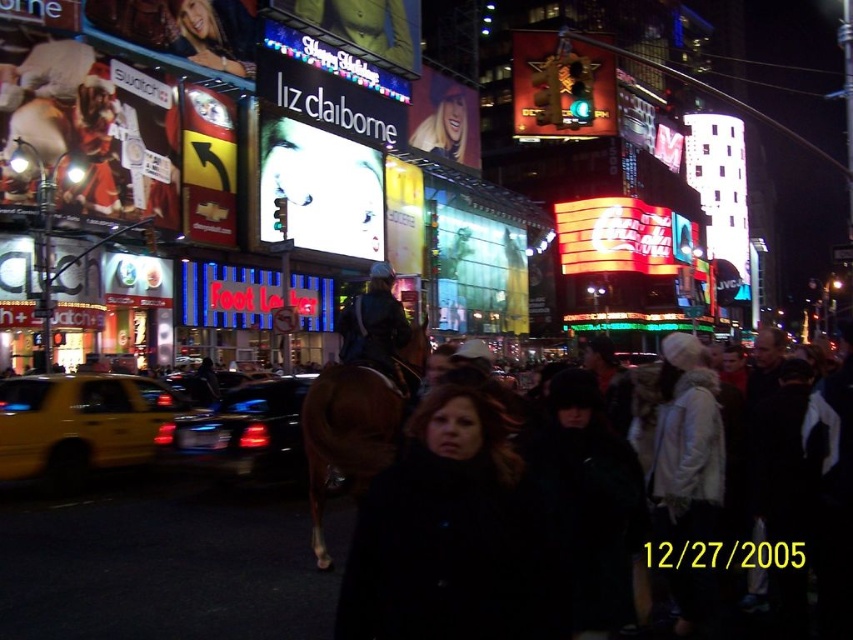
You are a pedestrian standing on the sidewalk in Times Square. You see a yellow matte taxi at left and a dark brown leather jacket at center. Which object is positioned more to the left?

The yellow matte taxi at left is positioned more to the left than the dark brown leather jacket at center.